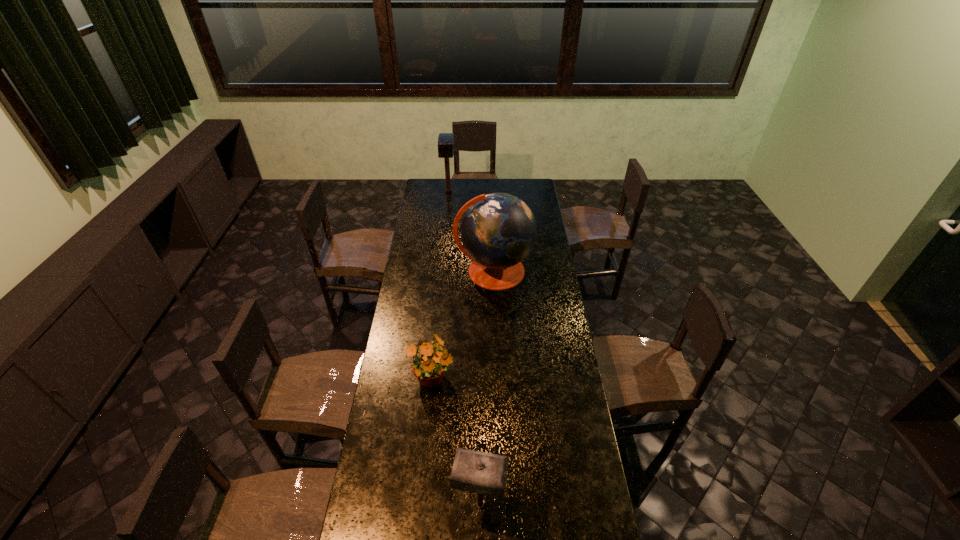
Identify which object is the second closest to the third nearest object. Please provide its 2D coordinates. Your answer should be formatted as a tuple, i.e. [(x, y)], where the tuple contains the x and y coordinates of a point satisfying the conditions above.

[(445, 140)]

What are the coordinates of `free location that satisfies the following two spatial constraints: 1. on the front side of the farthest object; 2. on the right side of the shorter mallet` in the screenshot? It's located at (418, 504).